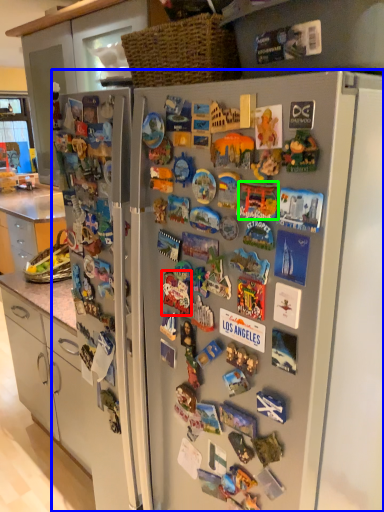
Question: Based on their relative distances, which object is nearer to toy (highlighted by a red box)? Choose from refrigerator (highlighted by a blue box) and toy (highlighted by a green box).

Choices:
 (A) refrigerator
 (B) toy

Answer: (B)